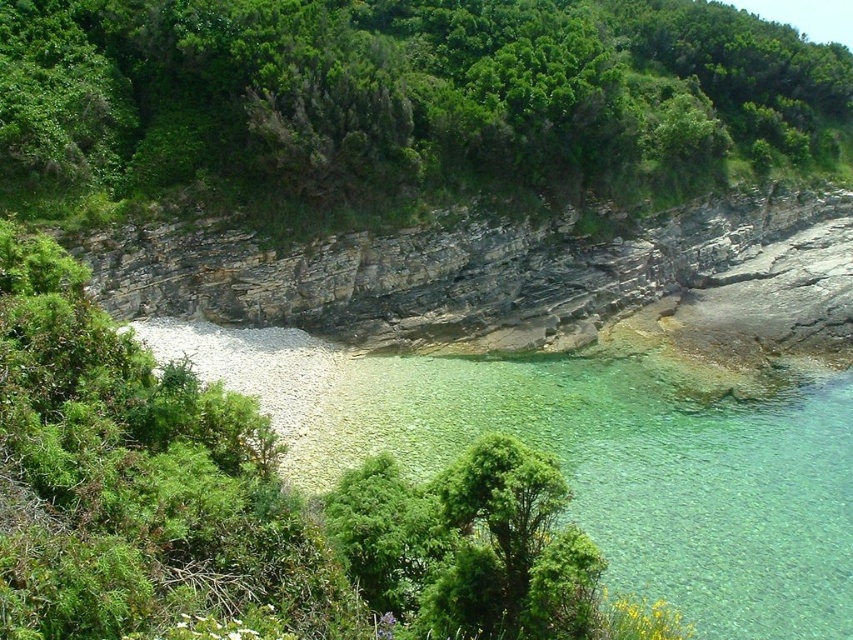
Question: Which of the following is the closest to the observer?

Choices:
 (A) (718, 262)
 (B) (236, 26)

Answer: (B)

Question: Is green leafy tree at upper center to the right of rocky cliff at center from the viewer's perspective?

Choices:
 (A) yes
 (B) no

Answer: (B)

Question: Which of the following is the farthest from the observer?

Choices:
 (A) (804, 109)
 (B) (755, 259)

Answer: (A)

Question: Does green leafy tree at upper center appear on the left side of rocky cliff at center?

Choices:
 (A) yes
 (B) no

Answer: (A)

Question: Where is green leafy tree at upper center located in relation to rocky cliff at center in the image?

Choices:
 (A) above
 (B) below

Answer: (A)